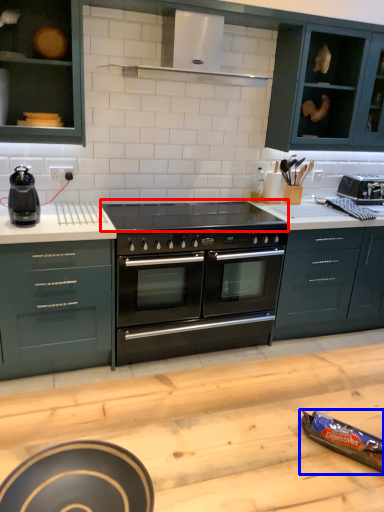
Question: Which of the following is the farthest to the observer, gas stove (highlighted by a red box) or appliance (highlighted by a blue box)?

Choices:
 (A) gas stove
 (B) appliance

Answer: (A)